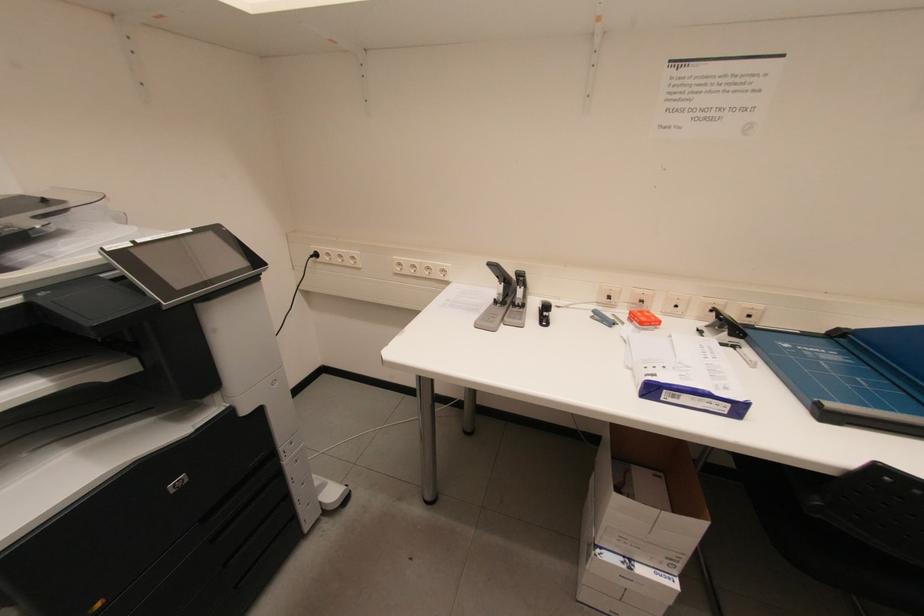
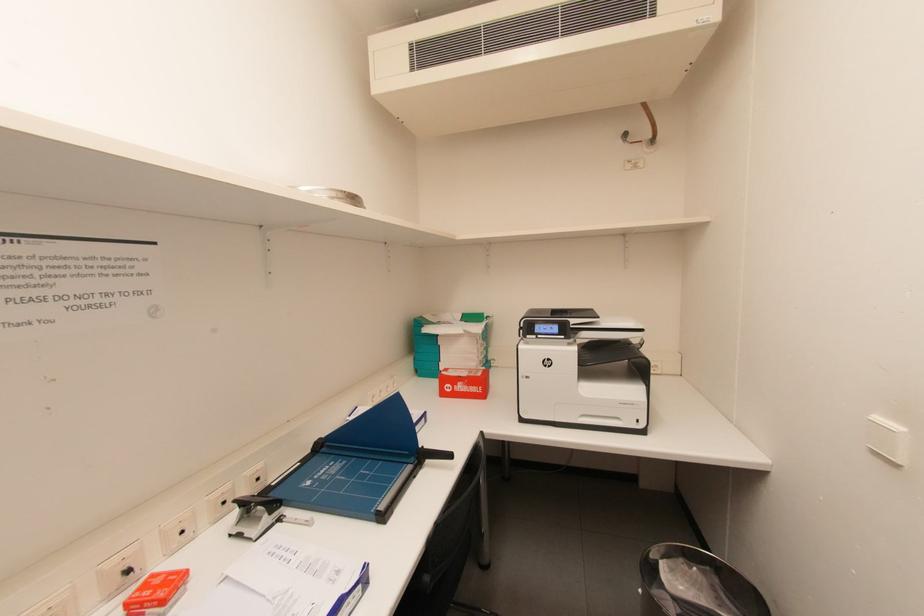
Question: The camera is either moving clockwise (left) or counter-clockwise (right) around the object. The first image is from the beginning of the video and the second image is from the end. Is the camera moving left or right when shooting the video?

Choices:
 (A) Left
 (B) Right

Answer: (A)